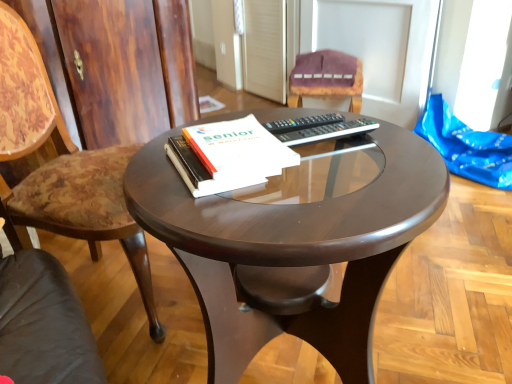
Where is `unoccupied area in front of black plastic remote at center`? The width and height of the screenshot is (512, 384). unoccupied area in front of black plastic remote at center is located at coordinates (368, 182).